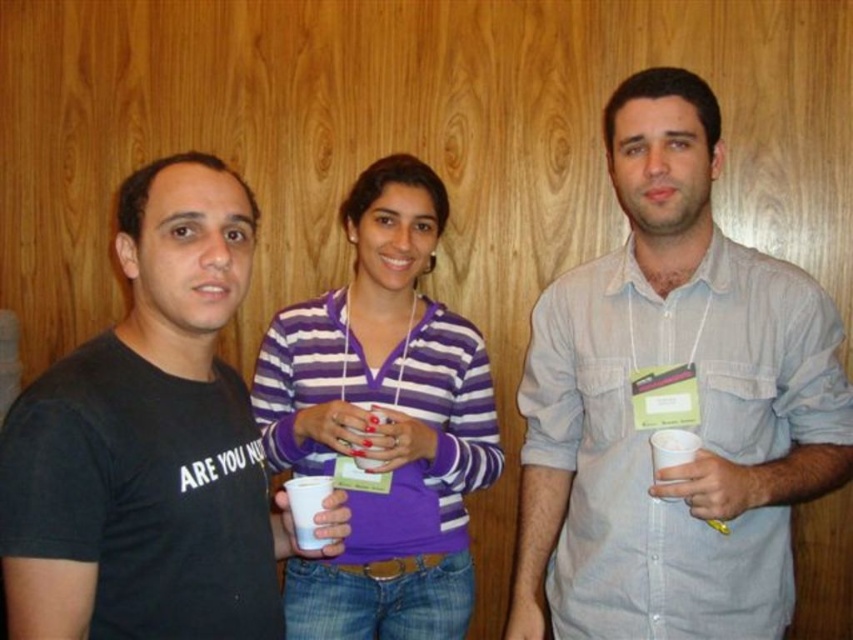
Question: Can you confirm if purple striped sweater at center is positioned to the right of white paper cup at right?

Choices:
 (A) no
 (B) yes

Answer: (A)

Question: Is purple striped sweater at center above white paper cup at right?

Choices:
 (A) no
 (B) yes

Answer: (B)

Question: Which point is farther to the camera?

Choices:
 (A) (485, 433)
 (B) (259, 490)
 (C) (670, 440)
 (D) (682, 221)

Answer: (A)

Question: Which point appears farthest from the camera in this image?

Choices:
 (A) (378, 376)
 (B) (648, 438)
 (C) (22, 637)

Answer: (A)

Question: Which object is farther from the camera taking this photo?

Choices:
 (A) white paper cup at right
 (B) purple striped sweater at center
 (C) black cotton t-shirt at left
 (D) light blue shirt at center

Answer: (B)

Question: Can you confirm if purple striped sweater at center is positioned to the right of white paper cup at center?

Choices:
 (A) yes
 (B) no

Answer: (A)